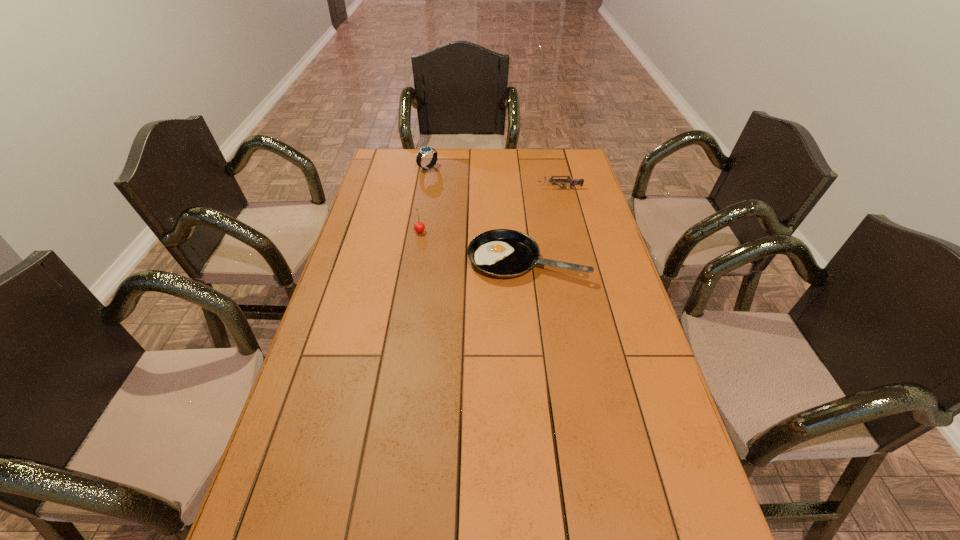
The image size is (960, 540). I want to click on watch, so click(424, 151).

The height and width of the screenshot is (540, 960). In order to click on cherry in this screenshot , I will do `click(419, 227)`.

The width and height of the screenshot is (960, 540). In order to click on gun in this screenshot , I will do `click(572, 182)`.

Locate an element on the screen. Image resolution: width=960 pixels, height=540 pixels. the nearest object is located at coordinates (503, 253).

The width and height of the screenshot is (960, 540). Find the location of `free space located 0.300m on the right of the farthest object`. free space located 0.300m on the right of the farthest object is located at coordinates (508, 167).

The height and width of the screenshot is (540, 960). Identify the location of free space located 0.330m on the front of the third farthest object. (408, 304).

The image size is (960, 540). Identify the location of blank area located aimed along the barrel of the gun. (455, 188).

At what (x,y) coordinates should I click in order to perform the action: click on vacant area located 0.340m aimed along the barrel of the gun. Please return your answer as a coordinate pair (x, y). The height and width of the screenshot is (540, 960). Looking at the image, I should click on (452, 188).

Image resolution: width=960 pixels, height=540 pixels. Find the location of `vacant area located 0.110m aimed along the barrel of the gun`. vacant area located 0.110m aimed along the barrel of the gun is located at coordinates (510, 188).

Locate an element on the screen. Image resolution: width=960 pixels, height=540 pixels. free space located 0.380m on the left of the frying pan is located at coordinates (351, 259).